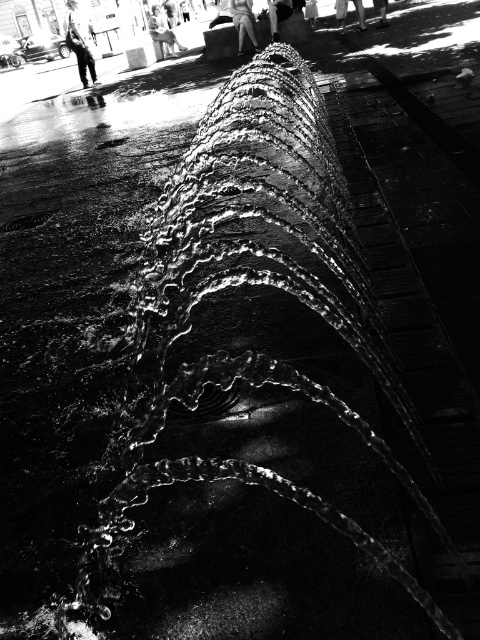
Question: Does dark clothing figure at upper left lie in front of smooth skin person at center?

Choices:
 (A) no
 (B) yes

Answer: (A)

Question: Estimate the real-world distances between objects in this image. Which object is closer to the light skin tone clothing at upper center?

Choices:
 (A) white cotton dress at center
 (B) skinny jeans at lower right
 (C) smooth skin person at center

Answer: (A)

Question: Which object appears farthest from the camera in this image?

Choices:
 (A) denim pants at center
 (B) dark clothing figure at upper left

Answer: (B)

Question: Which of the following is the farthest from the observer?

Choices:
 (A) smooth skin person at center
 (B) light skin tone clothing at upper center
 (C) denim pants at center

Answer: (B)

Question: Does denim pants at center have a larger size compared to smooth skin person at center?

Choices:
 (A) yes
 (B) no

Answer: (A)

Question: Does light skin tone clothing at upper center appear on the right side of white cotton dress at center?

Choices:
 (A) yes
 (B) no

Answer: (B)